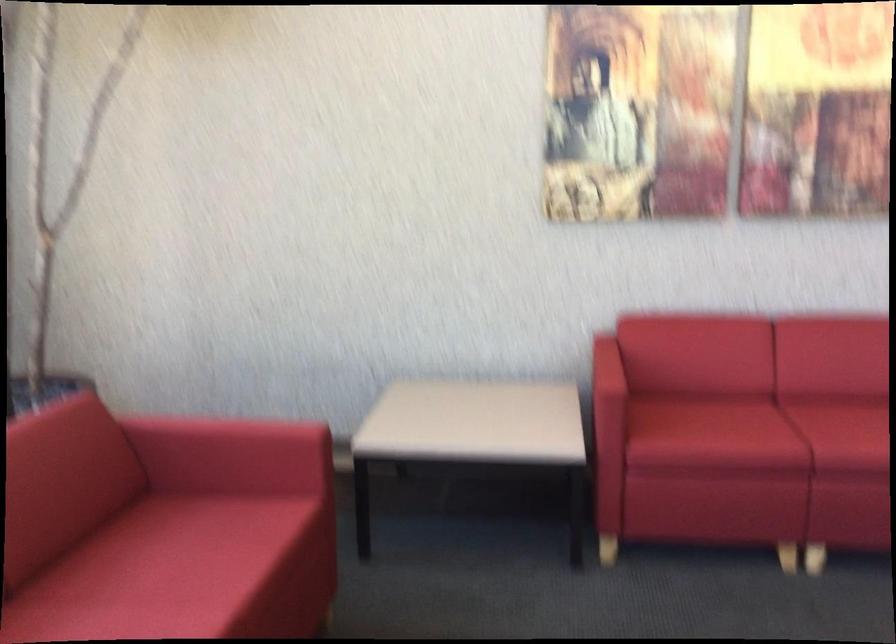
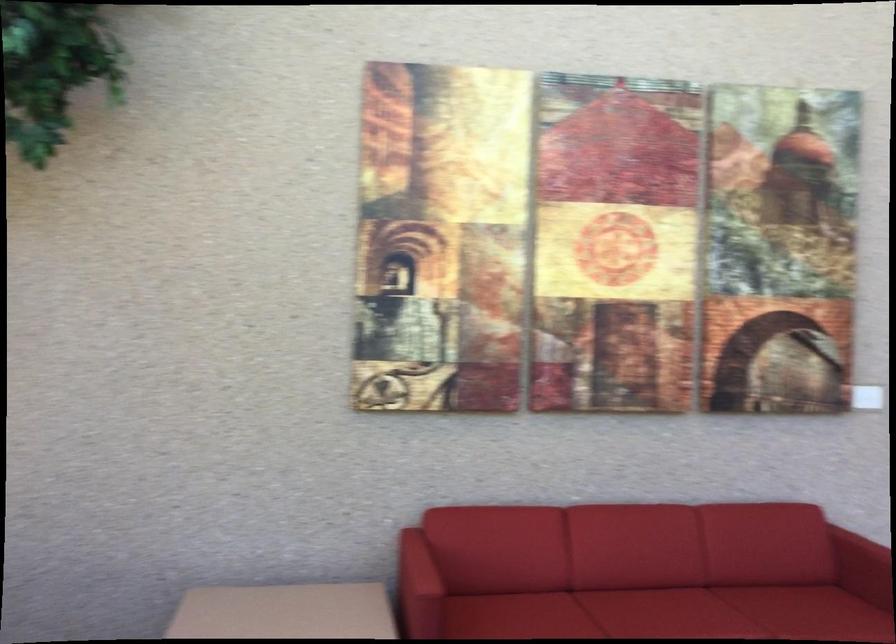
Find the pixel in the second image that matches point (606, 361) in the first image.

(418, 564)